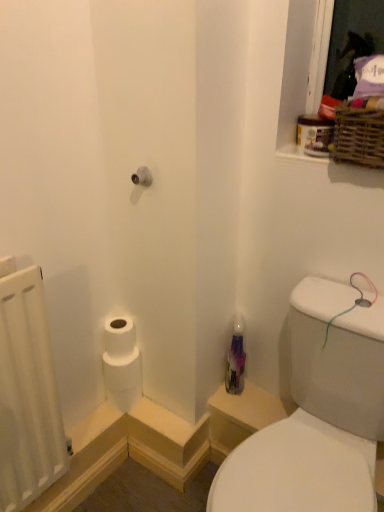
Identify the location of free location in front of translucent purple bottle at center. (238, 407).